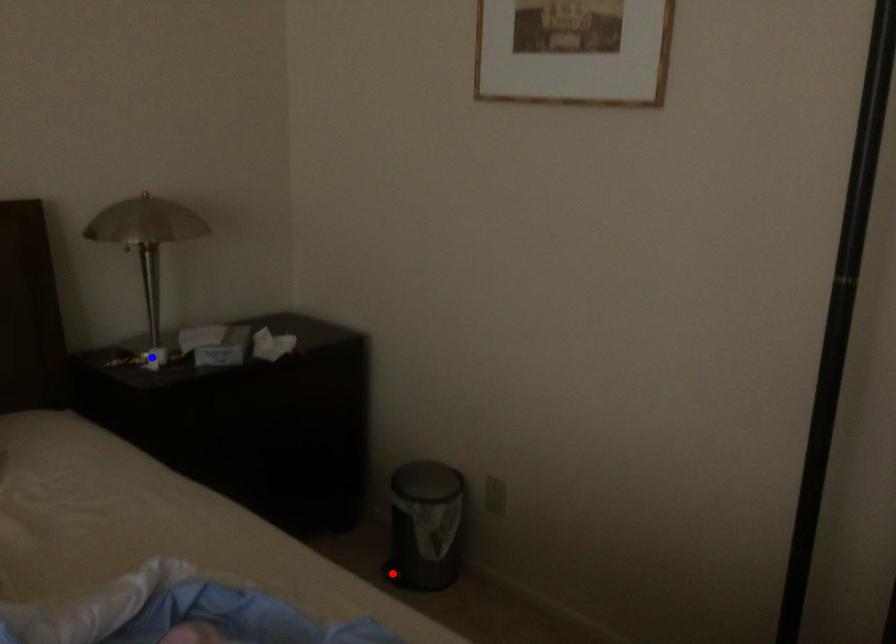
Question: Which of the two points in the image is closer to the camera?

Choices:
 (A) Blue point is closer.
 (B) Red point is closer.

Answer: (A)